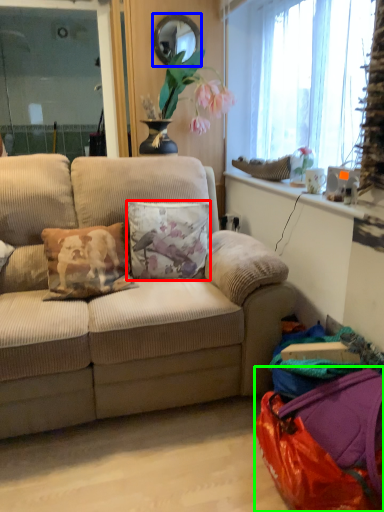
Question: Based on their relative distances, which object is farther from pillow (highlighted by a red box)? Choose from mirror (highlighted by a blue box) and bag (highlighted by a green box).

Choices:
 (A) mirror
 (B) bag

Answer: (A)